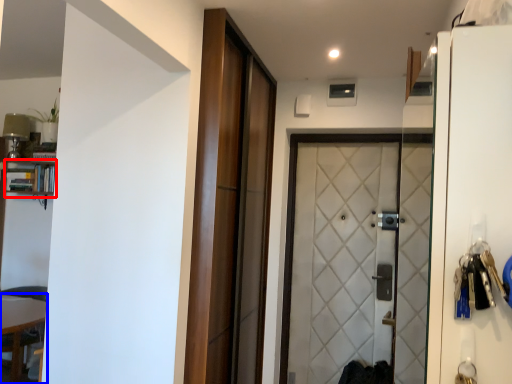
Question: Which object is further to the camera taking this photo, bookshelf (highlighted by a red box) or table (highlighted by a blue box)?

Choices:
 (A) bookshelf
 (B) table

Answer: (A)